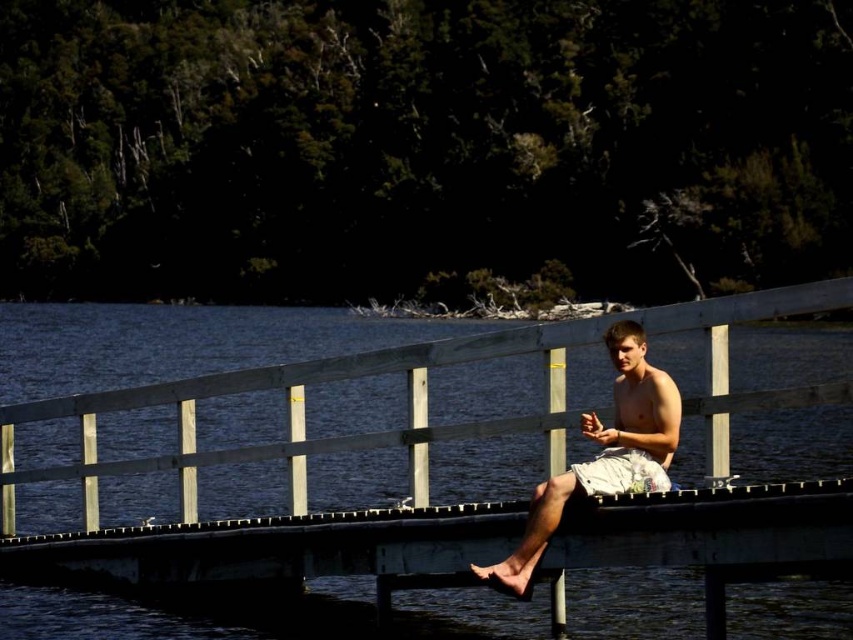
Question: Which point is closer to the camera?

Choices:
 (A) (610, 454)
 (B) (618, 321)
 (C) (238, 531)
 (D) (606, 380)

Answer: (A)

Question: Which object is closer to the camera taking this photo?

Choices:
 (A) white cotton shorts at center
 (B) light beige shorts at center
 (C) white painted wood dock at center

Answer: (C)

Question: Can you confirm if blue water at center is positioned to the left of white cotton shorts at center?

Choices:
 (A) yes
 (B) no

Answer: (A)

Question: Estimate the real-world distances between objects in this image. Which object is farther from the white cotton shorts at center?

Choices:
 (A) light beige shorts at center
 (B) blue water at center

Answer: (B)

Question: From the image, what is the correct spatial relationship of light beige shorts at center in relation to white cotton shorts at center?

Choices:
 (A) left
 (B) right

Answer: (A)

Question: In this image, where is white painted wood dock at center located relative to light beige shorts at center?

Choices:
 (A) below
 (B) above

Answer: (A)